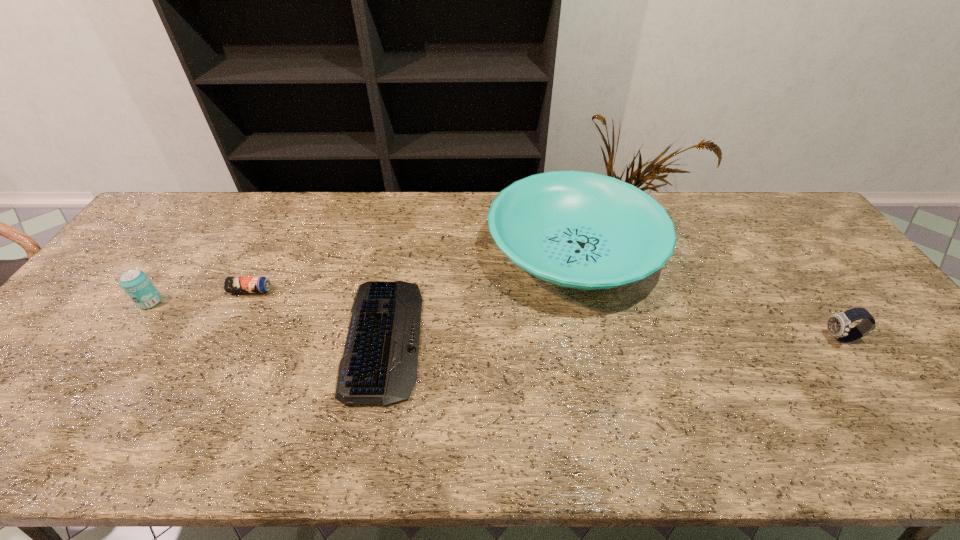
In the image, there is a desktop. Where is `vacant space at the near edge`? The width and height of the screenshot is (960, 540). vacant space at the near edge is located at coordinates (837, 426).

In the image, there is a desktop. Identify the location of vacant space at the right edge. (783, 248).

I want to click on vacant space at the far right corner of the desktop, so click(x=789, y=228).

Image resolution: width=960 pixels, height=540 pixels. In order to click on vacant area that lies between the second shortest object and the rightmost object in this screenshot , I will do `click(545, 314)`.

Locate an element on the screen. Image resolution: width=960 pixels, height=540 pixels. vacant region between the dish and the fourth tallest object is located at coordinates pos(412,271).

The height and width of the screenshot is (540, 960). What are the coordinates of `vacant area that lies between the fourth tallest object and the shortest object` in the screenshot? It's located at coord(317,314).

Image resolution: width=960 pixels, height=540 pixels. Find the location of `empty space that is in between the third object from left to right and the second shortest object`. empty space that is in between the third object from left to right and the second shortest object is located at coordinates (317, 314).

You are a GUI agent. You are given a task and a screenshot of the screen. Output one action in this format:
    pyautogui.click(x=<x>, y=<y>)
    Task: Click on the vacant space in between the shortest object and the taller beer can
    
    Given the screenshot: What is the action you would take?
    tap(267, 320)

I want to click on free space between the left beer can and the third object from left to right, so click(267, 320).

The width and height of the screenshot is (960, 540). I want to click on free space between the taller beer can and the rightmost object, so click(x=495, y=320).